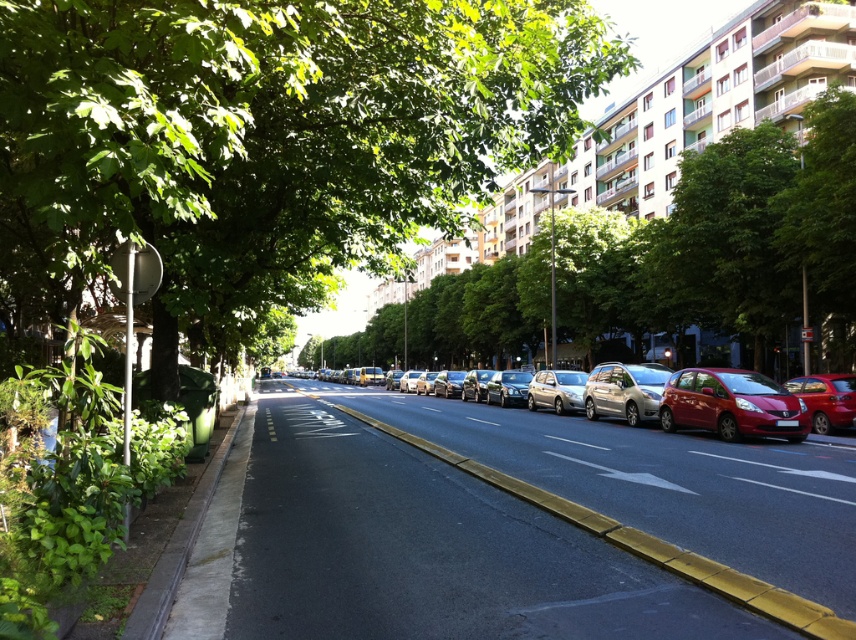
Question: Based on their relative distances, which object is farther from the green leafy tree at upper center?

Choices:
 (A) matte red car at right
 (B) satin silver car at center
 (C) satin silver sedan at center

Answer: (C)

Question: Which of these objects is positioned farthest from the shiny red car at right?

Choices:
 (A) green leafy tree at upper center
 (B) green leafy tree at center

Answer: (A)

Question: Where is metallic silver car at center located in relation to satin silver car at center in the image?

Choices:
 (A) above
 (B) below

Answer: (B)

Question: Can you confirm if metallic silver car at center is positioned to the left of satin silver sedan at center?

Choices:
 (A) no
 (B) yes

Answer: (B)

Question: Observing the image, what is the correct spatial positioning of satin silver car at center in reference to satin silver sedan at center?

Choices:
 (A) right
 (B) left

Answer: (A)

Question: Which point is closer to the camera taking this photo?

Choices:
 (A) (40, 4)
 (B) (830, 374)
 (C) (722, 188)
 (D) (385, 404)

Answer: (A)